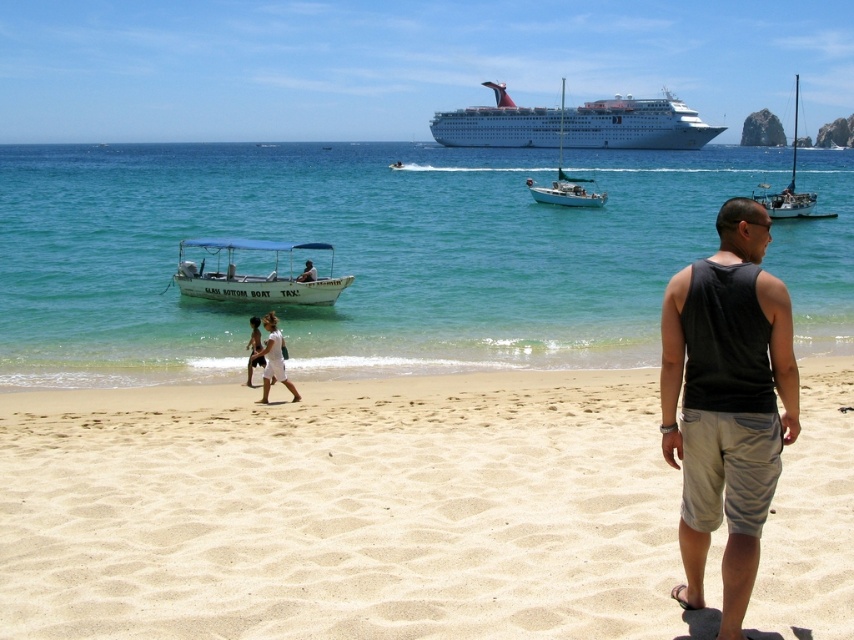
Question: Can you confirm if white glossy cruise ship at upper center is thinner than white cotton dress at center?

Choices:
 (A) no
 (B) yes

Answer: (A)

Question: Where is white glossy cruise ship at upper center located in relation to white sailboat at right in the image?

Choices:
 (A) left
 (B) right

Answer: (A)

Question: Which point is farther to the camera?

Choices:
 (A) light beige sand at lower center
 (B) clear blue water at beach front
 (C) white glossy cruise ship at upper center
 (D) white sailboat at right

Answer: (C)

Question: Can you confirm if white matte motor boat at center is wider than white cotton dress at center?

Choices:
 (A) yes
 (B) no

Answer: (A)

Question: Which of the following is the farthest from the observer?

Choices:
 (A) white fabric dress at lower center
 (B) white matte motor boat at center

Answer: (B)

Question: Based on their relative distances, which object is nearer to the black cotton tank top at right?

Choices:
 (A) white glossy sailboat at center
 (B) white cotton dress at center
 (C) white glossy cruise ship at upper center
 (D) clear blue water at beach front

Answer: (B)